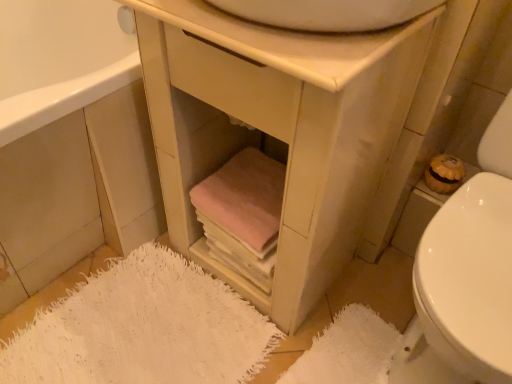
Question: Can you confirm if matte wood cabinet at lower left is bigger than white textured bath mat at lower right, the 2th bath mat positioned from the left?

Choices:
 (A) no
 (B) yes

Answer: (B)

Question: Is matte wood cabinet at lower left looking in the opposite direction of white textured bath mat at lower right, the 2th bath mat positioned from the left?

Choices:
 (A) yes
 (B) no

Answer: (B)

Question: From a real-world perspective, is matte wood cabinet at lower left on white textured bath mat at lower right, the 2th bath mat positioned from the left?

Choices:
 (A) yes
 (B) no

Answer: (A)

Question: Considering the relative sizes of matte wood cabinet at lower left and white textured bath mat at lower right, the 1th bath mat positioned from the right, in the image provided, is matte wood cabinet at lower left thinner than white textured bath mat at lower right, the 1th bath mat positioned from the right,?

Choices:
 (A) no
 (B) yes

Answer: (A)

Question: Is matte wood cabinet at lower left with white textured bath mat at lower right, the 1th bath mat positioned from the right?

Choices:
 (A) yes
 (B) no

Answer: (B)

Question: Considering the relative positions of white glossy toilet at lower right and matte wood cabinet at lower left in the image provided, is white glossy toilet at lower right to the left or to the right of matte wood cabinet at lower left?

Choices:
 (A) left
 (B) right

Answer: (B)

Question: Is white glossy toilet at lower right wider or thinner than matte wood cabinet at lower left?

Choices:
 (A) thin
 (B) wide

Answer: (A)

Question: Choose the correct answer: Is white glossy toilet at lower right inside matte wood cabinet at lower left or outside it?

Choices:
 (A) outside
 (B) inside

Answer: (A)

Question: Based on their sizes in the image, would you say white glossy toilet at lower right is bigger or smaller than matte wood cabinet at lower left?

Choices:
 (A) big
 (B) small

Answer: (B)

Question: From a real-world perspective, is white fuzzy bath mat at lower left, arranged as the first bath mat when viewed from the left, above or below pink fabric towels at lower center?

Choices:
 (A) below
 (B) above

Answer: (A)

Question: Is point (45, 367) closer or farther from the camera than point (223, 195)?

Choices:
 (A) farther
 (B) closer

Answer: (B)

Question: In terms of size, does white fuzzy bath mat at lower left, which is counted as the second bath mat, starting from the right, appear bigger or smaller than pink fabric towels at lower center?

Choices:
 (A) big
 (B) small

Answer: (B)

Question: Is white fuzzy bath mat at lower left, arranged as the first bath mat when viewed from the left, taller or shorter than pink fabric towels at lower center?

Choices:
 (A) tall
 (B) short

Answer: (B)

Question: Looking at the image, does white fuzzy bath mat at lower left, which is counted as the second bath mat, starting from the right, seem bigger or smaller compared to white glossy toilet at lower right?

Choices:
 (A) small
 (B) big

Answer: (A)

Question: From a real-world perspective, relative to white glossy toilet at lower right, is white fuzzy bath mat at lower left, which is counted as the second bath mat, starting from the right, vertically above or below?

Choices:
 (A) below
 (B) above

Answer: (A)